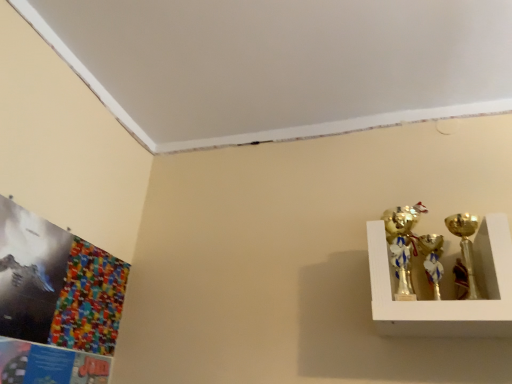
Question: From a real-world perspective, is gold metallic trophy at upper right, the 2th candle holder in the right-to-left sequence, under gold metallic candle holder at right, marked as the second candle holder in a left-to-right arrangement?

Choices:
 (A) no
 (B) yes

Answer: (A)

Question: Is gold metallic trophy at upper right, the 2th candle holder in the right-to-left sequence, positioned in front of gold metallic candle holder at right, which ranks as the 1th candle holder in right-to-left order?

Choices:
 (A) yes
 (B) no

Answer: (B)

Question: Is gold metallic trophy at upper right, the first candle holder positioned from the left, further to the viewer compared to gold metallic candle holder at right, marked as the second candle holder in a left-to-right arrangement?

Choices:
 (A) yes
 (B) no

Answer: (A)

Question: Does gold metallic trophy at upper right, the 2th candle holder in the right-to-left sequence, have a smaller size compared to gold metallic candle holder at right, marked as the second candle holder in a left-to-right arrangement?

Choices:
 (A) yes
 (B) no

Answer: (A)

Question: Considering the relative positions of gold metallic trophy at upper right, the 2th candle holder in the right-to-left sequence, and gold metallic candle holder at right, marked as the second candle holder in a left-to-right arrangement, in the image provided, is gold metallic trophy at upper right, the 2th candle holder in the right-to-left sequence, to the left of gold metallic candle holder at right, marked as the second candle holder in a left-to-right arrangement, from the viewer's perspective?

Choices:
 (A) yes
 (B) no

Answer: (A)

Question: Considering the relative sizes of gold metallic trophy at upper right, the 2th candle holder in the right-to-left sequence, and gold metallic candle holder at right, which ranks as the 1th candle holder in right-to-left order, in the image provided, is gold metallic trophy at upper right, the 2th candle holder in the right-to-left sequence, taller than gold metallic candle holder at right, which ranks as the 1th candle holder in right-to-left order,?

Choices:
 (A) no
 (B) yes

Answer: (A)

Question: Is gold metallic candle holder at right, which ranks as the 1th candle holder in right-to-left order, outside of gold metallic trophy at upper right, the first candle holder positioned from the left?

Choices:
 (A) no
 (B) yes

Answer: (B)

Question: From a real-world perspective, is gold metallic candle holder at right, marked as the second candle holder in a left-to-right arrangement, on gold metallic trophy at upper right, the 2th candle holder in the right-to-left sequence?

Choices:
 (A) yes
 (B) no

Answer: (B)

Question: From the image's perspective, is gold metallic candle holder at right, marked as the second candle holder in a left-to-right arrangement, under gold metallic trophy at upper right, the 2th candle holder in the right-to-left sequence?

Choices:
 (A) yes
 (B) no

Answer: (A)

Question: Considering the relative sizes of gold metallic candle holder at right, marked as the second candle holder in a left-to-right arrangement, and gold metallic trophy at upper right, the 2th candle holder in the right-to-left sequence, in the image provided, is gold metallic candle holder at right, marked as the second candle holder in a left-to-right arrangement, smaller than gold metallic trophy at upper right, the 2th candle holder in the right-to-left sequence,?

Choices:
 (A) yes
 (B) no

Answer: (B)

Question: Is gold metallic candle holder at right, which ranks as the 1th candle holder in right-to-left order, in front of gold metallic trophy at upper right, the first candle holder positioned from the left?

Choices:
 (A) yes
 (B) no

Answer: (A)

Question: Is gold metallic candle holder at right, which ranks as the 1th candle holder in right-to-left order, touching gold metallic trophy at upper right, the 2th candle holder in the right-to-left sequence?

Choices:
 (A) yes
 (B) no

Answer: (B)

Question: In terms of width, does gold metallic candle holder at right, which ranks as the 1th candle holder in right-to-left order, look wider or thinner when compared to gold metallic trophy at upper right, the 2th candle holder in the right-to-left sequence?

Choices:
 (A) wide
 (B) thin

Answer: (A)